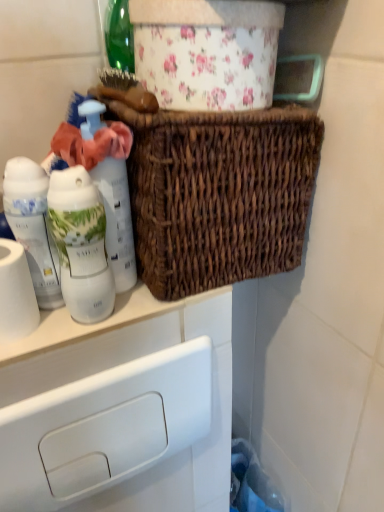
Question: Considering the relative sizes of white glossy bottle at left, positioned as the second bottle in right-to-left order, and woven brown basket at upper center in the image provided, is white glossy bottle at left, positioned as the second bottle in right-to-left order, shorter than woven brown basket at upper center?

Choices:
 (A) yes
 (B) no

Answer: (A)

Question: From the image's perspective, is white glossy bottle at left, arranged as the second bottle when viewed from the left, located above woven brown basket at upper center?

Choices:
 (A) no
 (B) yes

Answer: (A)

Question: From the image's perspective, is white glossy bottle at left, arranged as the second bottle when viewed from the left, beneath woven brown basket at upper center?

Choices:
 (A) yes
 (B) no

Answer: (A)

Question: Is white glossy bottle at left, arranged as the second bottle when viewed from the left, placed right next to woven brown basket at upper center?

Choices:
 (A) no
 (B) yes

Answer: (A)

Question: Is white glossy bottle at left, arranged as the second bottle when viewed from the left, behind woven brown basket at upper center?

Choices:
 (A) no
 (B) yes

Answer: (B)

Question: Would you say white matte bottle at left, marked as the 1th bottle in a right-to-left arrangement, is inside or outside woven brown basket at upper center?

Choices:
 (A) outside
 (B) inside

Answer: (A)

Question: In the image, is white matte bottle at left, the third bottle from the left, positioned in front of or behind woven brown basket at upper center?

Choices:
 (A) behind
 (B) front

Answer: (A)

Question: Based on their sizes in the image, would you say white matte bottle at left, marked as the 1th bottle in a right-to-left arrangement, is bigger or smaller than woven brown basket at upper center?

Choices:
 (A) small
 (B) big

Answer: (A)

Question: From a real-world perspective, is white matte bottle at left, the third bottle from the left, physically located above or below woven brown basket at upper center?

Choices:
 (A) above
 (B) below

Answer: (B)

Question: Considering the positions of point (99, 164) and point (18, 336), is point (99, 164) closer or farther from the camera than point (18, 336)?

Choices:
 (A) farther
 (B) closer

Answer: (B)

Question: From their relative heights in the image, would you say white matte bottle at left, the third bottle from the left, is taller or shorter than white matte toilet paper at left?

Choices:
 (A) short
 (B) tall

Answer: (B)

Question: In terms of size, does white matte bottle at left, the third bottle from the left, appear bigger or smaller than white matte toilet paper at left?

Choices:
 (A) small
 (B) big

Answer: (B)

Question: From the image's perspective, is white matte bottle at left, marked as the 1th bottle in a right-to-left arrangement, above or below white matte toilet paper at left?

Choices:
 (A) below
 (B) above

Answer: (B)

Question: In terms of width, does white matte toilet paper at left look wider or thinner when compared to white glossy lotion at left, placed as the 3th bottle when sorted from right to left?

Choices:
 (A) thin
 (B) wide

Answer: (B)

Question: In the image, is white matte toilet paper at left on the left side or the right side of white glossy lotion at left, placed as the 3th bottle when sorted from right to left?

Choices:
 (A) left
 (B) right

Answer: (A)